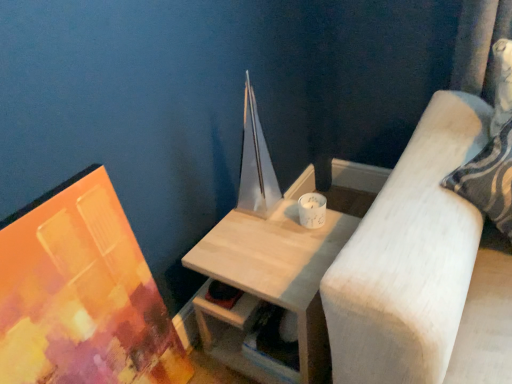
Where is `vacant space to the left of white ceramic candle at upper right`? The width and height of the screenshot is (512, 384). vacant space to the left of white ceramic candle at upper right is located at coordinates (260, 231).